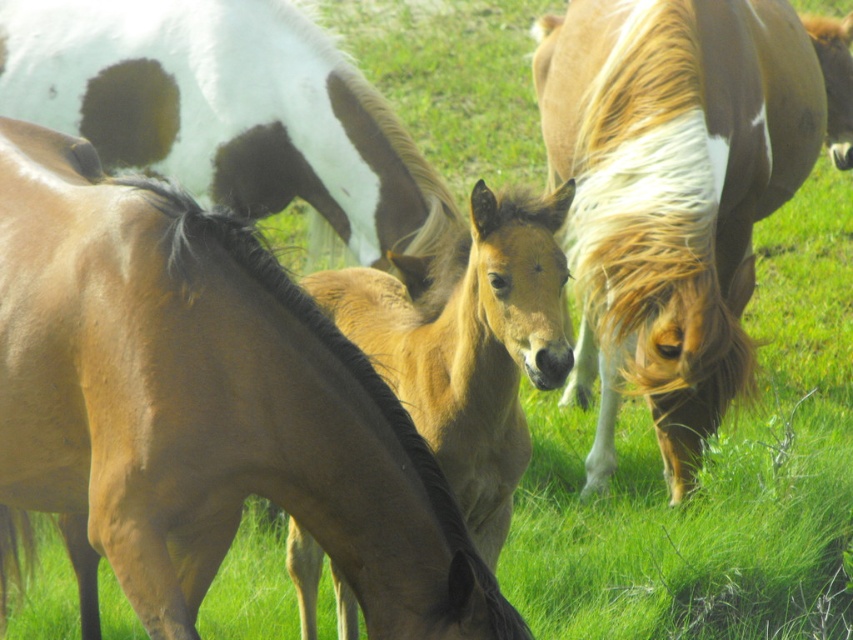
You are a photographer trying to capture a photo of the light brown glossy horse at center and the white glossy horse at upper left. From your current position, which horse is positioned to the right side of the other?

→ The light brown glossy horse at center is to the right of the white glossy horse at upper left.

You are a farmer checking the herd. You notice the light brown glossy horse at center and the white glossy horse at upper left. Which horse do you think is taller?

The light brown glossy horse at center is taller than the white glossy horse at upper left.